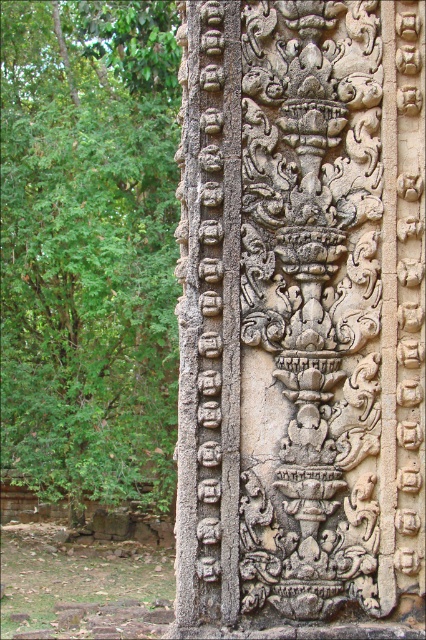
Who is shorter, carved stone vase at center or green leafy tree at left?

Standing shorter between the two is carved stone vase at center.

Between carved stone vase at center and green leafy tree at left, which one appears on the right side from the viewer's perspective?

From the viewer's perspective, carved stone vase at center appears more on the right side.

Describe the element at coordinates (301, 320) in the screenshot. Image resolution: width=426 pixels, height=640 pixels. I see `carved stone vase at center` at that location.

This screenshot has width=426, height=640. Find the location of `carved stone vase at center`. carved stone vase at center is located at coordinates (301, 320).